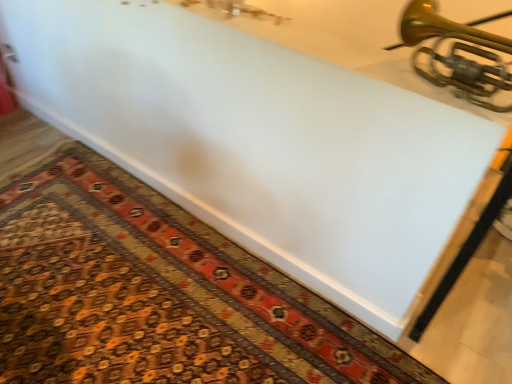
Question: From the image's perspective, is gold brass trumpet at upper right located above or below carpeted mat at lower center?

Choices:
 (A) below
 (B) above

Answer: (B)

Question: Would you say gold brass trumpet at upper right is to the left or to the right of carpeted mat at lower center in the picture?

Choices:
 (A) left
 (B) right

Answer: (B)

Question: From a real-world perspective, is gold brass trumpet at upper right positioned above or below carpeted mat at lower center?

Choices:
 (A) above
 (B) below

Answer: (A)

Question: Considering the positions of point (73, 195) and point (476, 29), is point (73, 195) closer or farther from the camera than point (476, 29)?

Choices:
 (A) closer
 (B) farther

Answer: (B)

Question: From a real-world perspective, is carpeted mat at lower center physically located above or below gold brass trumpet at upper right?

Choices:
 (A) below
 (B) above

Answer: (A)

Question: Is carpeted mat at lower center wider or thinner than gold brass trumpet at upper right?

Choices:
 (A) wide
 (B) thin

Answer: (A)

Question: In the image, is carpeted mat at lower center positioned in front of or behind gold brass trumpet at upper right?

Choices:
 (A) behind
 (B) front

Answer: (A)